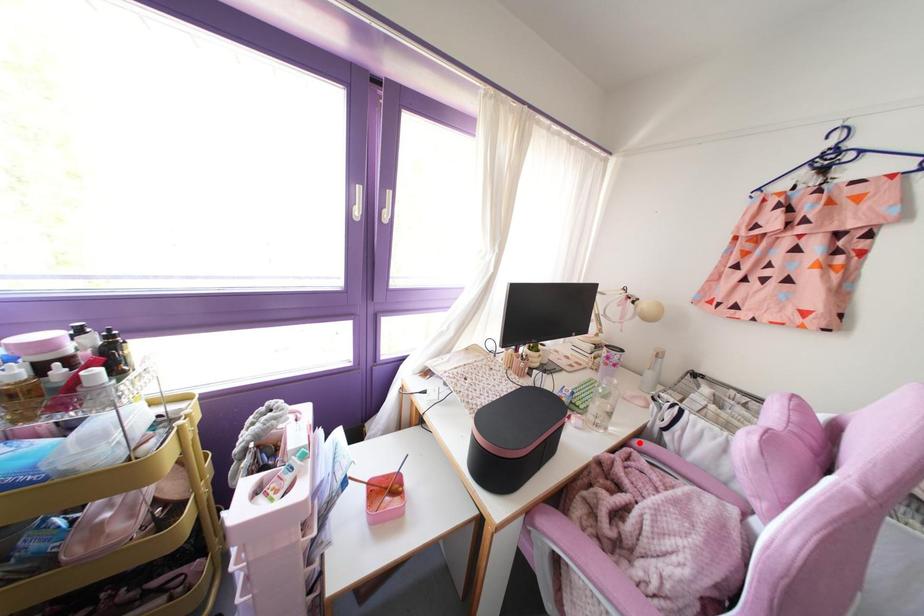
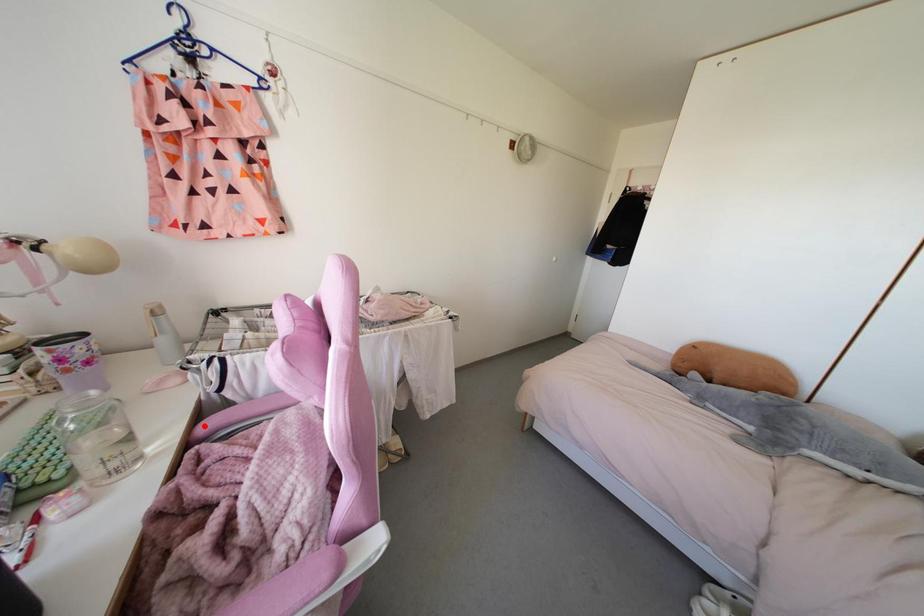
I am providing you with two images of the same scene from different viewpoints. A red point is marked on the first image and another point is marked on the second image. Is the red point in image1 aligned with the point shown in image2?

Yes